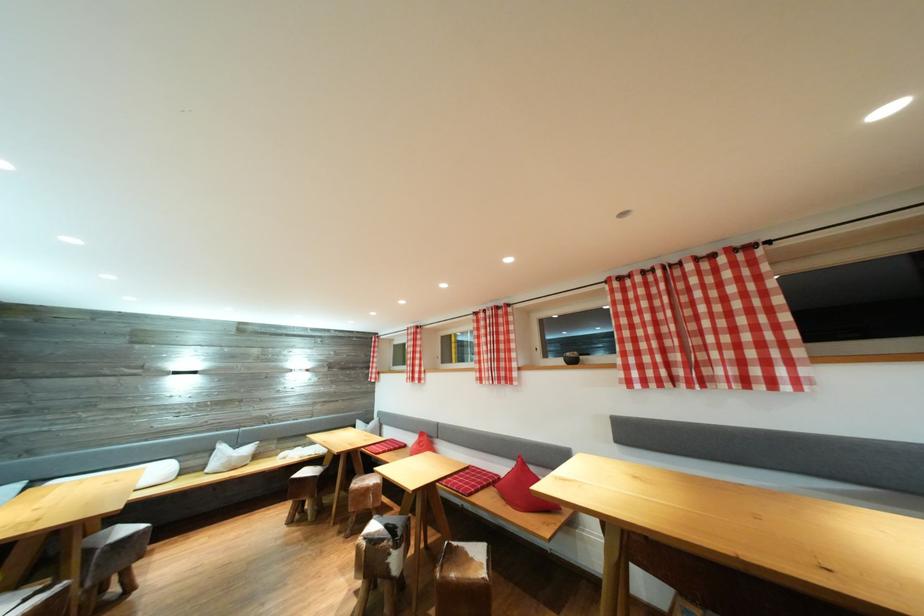
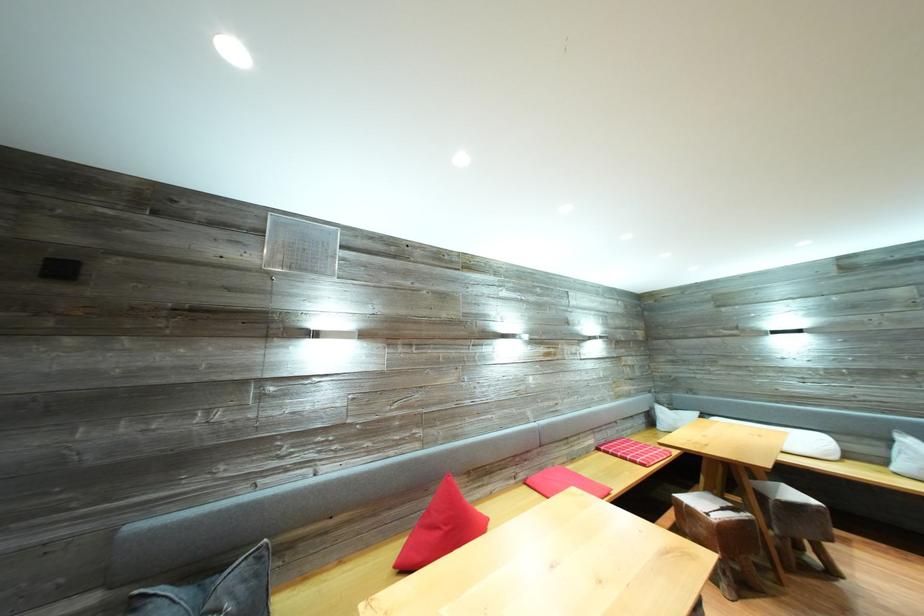
Question: How did the camera likely rotate?

Choices:
 (A) Left
 (B) Right
 (C) Up
 (D) Down

Answer: (A)